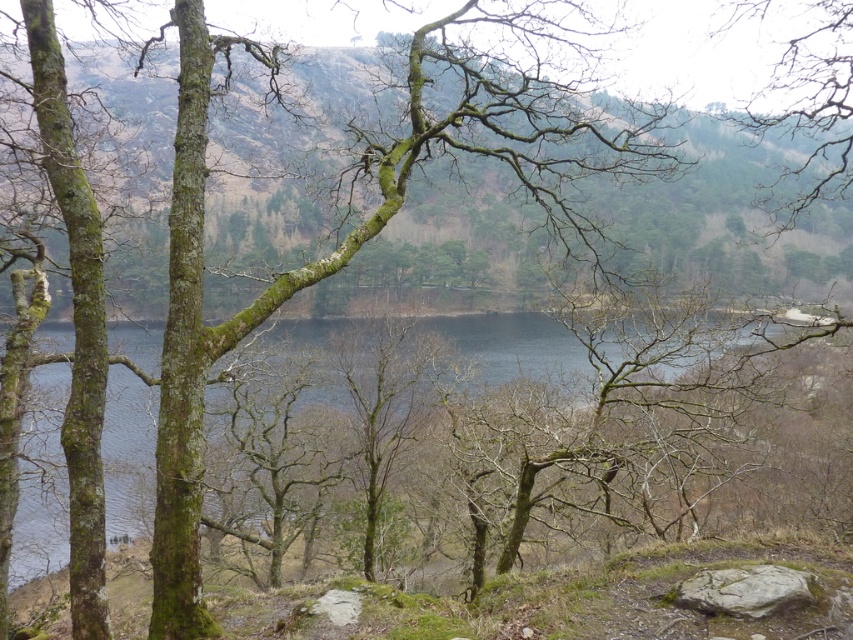
You are standing at the edge of the scene and want to step onto the gray rough rock at lower right. Is the dark blue water at center between you and the rock?

The dark blue water at center is positioned over the gray rough rock at lower right, meaning the rock is submerged under the water. Therefore, stepping onto the gray rough rock at lower right would require wading through the dark blue water at center.

You are standing at the edge of the lake and want to place a small boat in the water. The boat requires a clear path from the gray rough rock at lower right to the dark blue water at center. Is there enough space between them for the boat to move freely?

The dark blue water at center is to the left of the gray rough rock at lower right, so there is space between them for the boat to move freely.